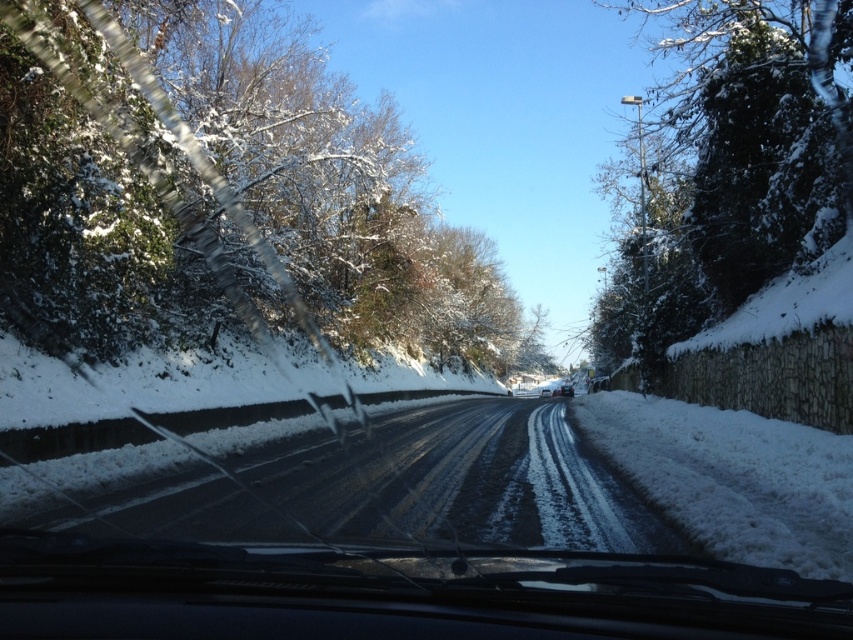
Is point (596, 314) more distant than point (567, 384)?

No, (596, 314) is in front of (567, 384).

Is snow-covered evergreen at right to the left of metallic silver car at center from the viewer's perspective?

No, snow-covered evergreen at right is not to the left of metallic silver car at center.

Describe the element at coordinates (729, 172) in the screenshot. I see `snow-covered evergreen at right` at that location.

Where is `snow-covered evergreen at right`? snow-covered evergreen at right is located at coordinates (729, 172).

Does snow-covered trees at left have a greater height compared to metallic silver car at center?

Yes, snow-covered trees at left is taller than metallic silver car at center.

Does snow-covered trees at left lie in front of metallic silver car at center?

Yes, snow-covered trees at left is closer to the viewer.

Between point (302, 189) and point (572, 394), which one is positioned behind?

The point (572, 394) is more distant.

What are the coordinates of `snow-covered trees at left` in the screenshot? It's located at (224, 193).

Is snow-covered trees at left above snow-covered evergreen at right?

Incorrect, snow-covered trees at left is not positioned above snow-covered evergreen at right.

Measure the distance from snow-covered trees at left to snow-covered evergreen at right.

snow-covered trees at left is 44.68 feet from snow-covered evergreen at right.

This screenshot has height=640, width=853. What are the coordinates of `snow-covered trees at left` in the screenshot? It's located at (224, 193).